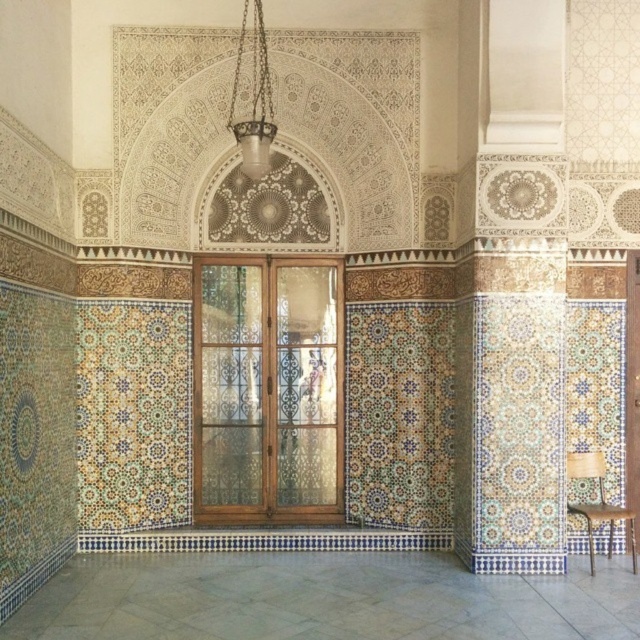
Question: Is clear glass door at center below metallic gold chandelier at upper center?

Choices:
 (A) yes
 (B) no

Answer: (A)

Question: Estimate the real-world distances between objects in this image. Which object is farther from the metallic gold chandelier at upper center?

Choices:
 (A) clear glass door at center
 (B) wooden chair at lower right

Answer: (B)

Question: Considering the real-world distances, which object is farthest from the clear glass door at center?

Choices:
 (A) wooden chair at lower right
 (B) metallic gold chandelier at upper center

Answer: (A)

Question: Which point is closer to the camera taking this photo?

Choices:
 (A) (260, 26)
 (B) (236, 497)

Answer: (A)

Question: Is the position of clear glass door at center more distant than that of wooden chair at lower right?

Choices:
 (A) yes
 (B) no

Answer: (A)

Question: Does metallic gold chandelier at upper center have a smaller size compared to wooden chair at lower right?

Choices:
 (A) no
 (B) yes

Answer: (B)